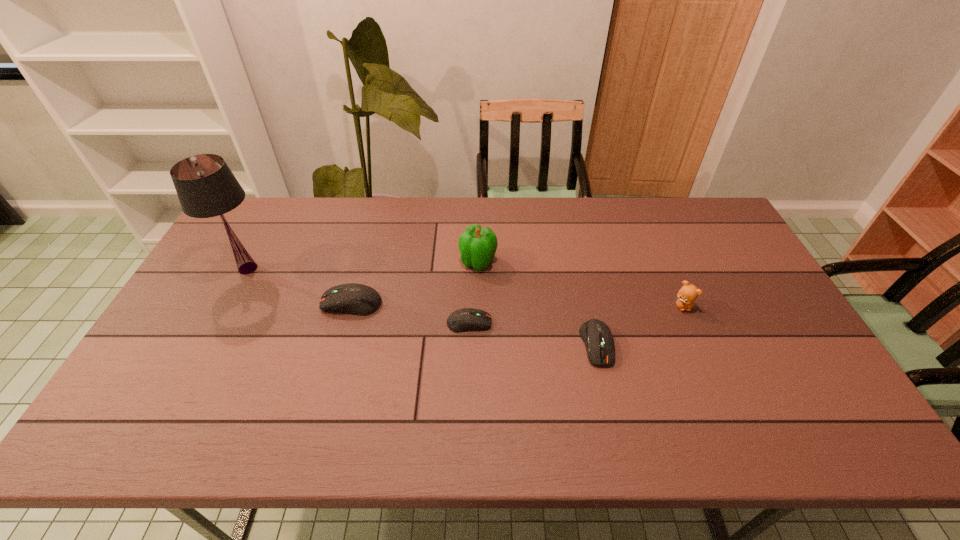
Locate an element on the screen. Image resolution: width=960 pixels, height=540 pixels. free location at the left edge of the desktop is located at coordinates (203, 338).

Where is `blank space at the right edge of the desktop`? This screenshot has width=960, height=540. blank space at the right edge of the desktop is located at coordinates (763, 315).

This screenshot has height=540, width=960. What are the coordinates of `vacant region at the far right corner of the desktop` in the screenshot? It's located at (685, 231).

Where is `vacant space that's between the shortest computer equipment and the leftmost computer equipment`? vacant space that's between the shortest computer equipment and the leftmost computer equipment is located at coordinates (410, 313).

Find the location of a particular element. free point between the tallest object and the third tallest object is located at coordinates (466, 287).

At what (x,y) coordinates should I click in order to perform the action: click on vacant space that is in between the teddy bear and the leftmost computer equipment. Please return your answer as a coordinate pair (x, y). The image size is (960, 540). Looking at the image, I should click on coord(517,305).

Find the location of `blank region between the teddy bear and the second shortest object`. blank region between the teddy bear and the second shortest object is located at coordinates (639, 325).

Identify the location of vacant space in between the lampshade and the fourth shortest object. (466, 287).

You are a GUI agent. You are given a task and a screenshot of the screen. Output one action in this format:
    pyautogui.click(x=<x>, y=<y>)
    Task: Click on the free area in between the rightmost object and the second object from left to right
    The image size is (960, 540).
    Given the screenshot: What is the action you would take?
    pyautogui.click(x=517, y=305)

The image size is (960, 540). I want to click on vacant area between the shortest computer equipment and the fifth object from left to right, so click(x=533, y=334).